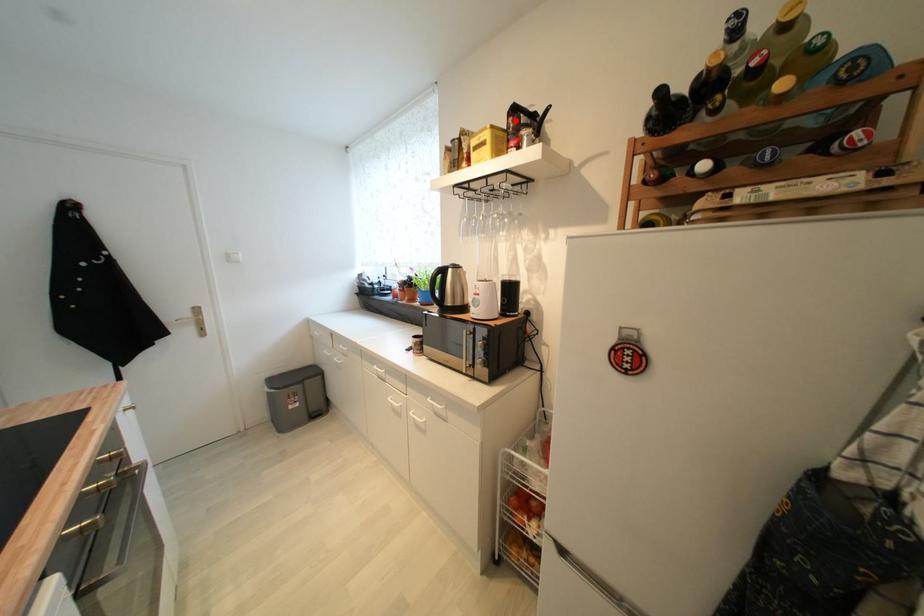
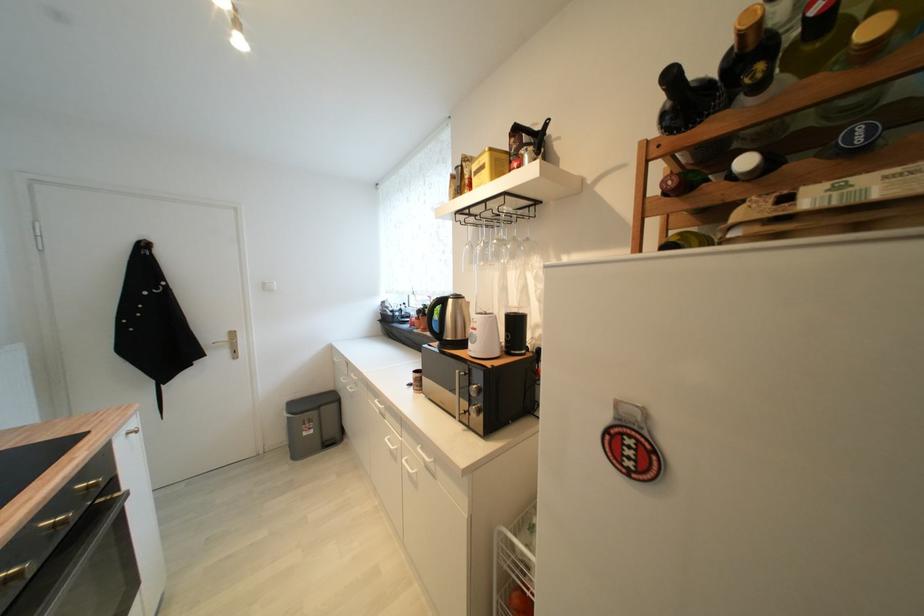
Where in the second image is the point corresponding to the highlighted location from the first image?

(517, 142)